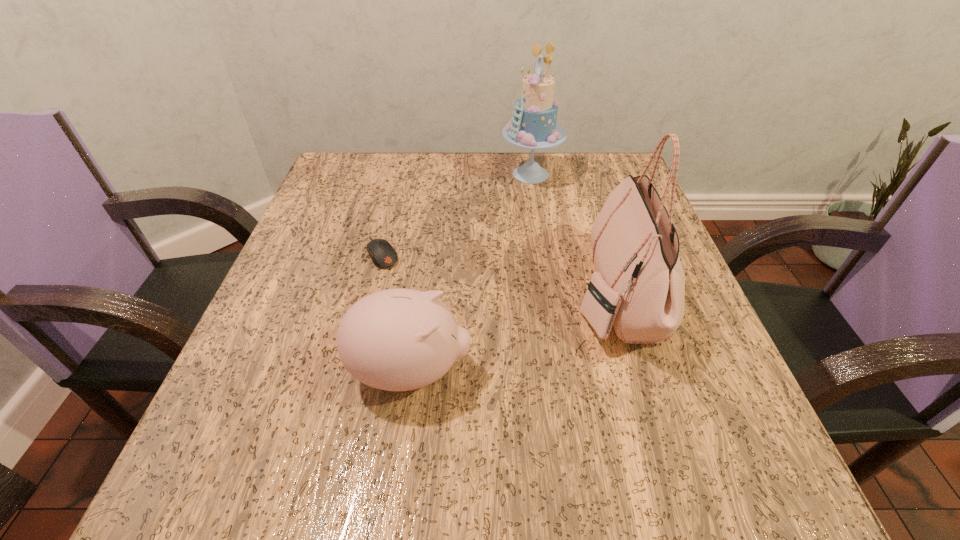
Identify the location of vacant space located at the snout of the piggy bank. This screenshot has height=540, width=960. (722, 371).

Where is `free spot located on the right of the computer mouse`? free spot located on the right of the computer mouse is located at coordinates (502, 253).

The height and width of the screenshot is (540, 960). Identify the location of object situated at the far edge. pos(533,126).

The width and height of the screenshot is (960, 540). I want to click on object located at the left edge, so click(382, 254).

Where is `object located in the right edge section of the desktop`? Image resolution: width=960 pixels, height=540 pixels. object located in the right edge section of the desktop is located at coordinates (638, 286).

Image resolution: width=960 pixels, height=540 pixels. I want to click on vacant area at the far edge, so click(x=496, y=181).

I want to click on vacant space at the near edge, so click(x=400, y=450).

Identify the location of vacant space at the left edge of the desktop. (276, 341).

The image size is (960, 540). I want to click on vacant space at the far left corner of the desktop, so click(320, 198).

Identify the location of free space at the near left corner. Image resolution: width=960 pixels, height=540 pixels. (225, 457).